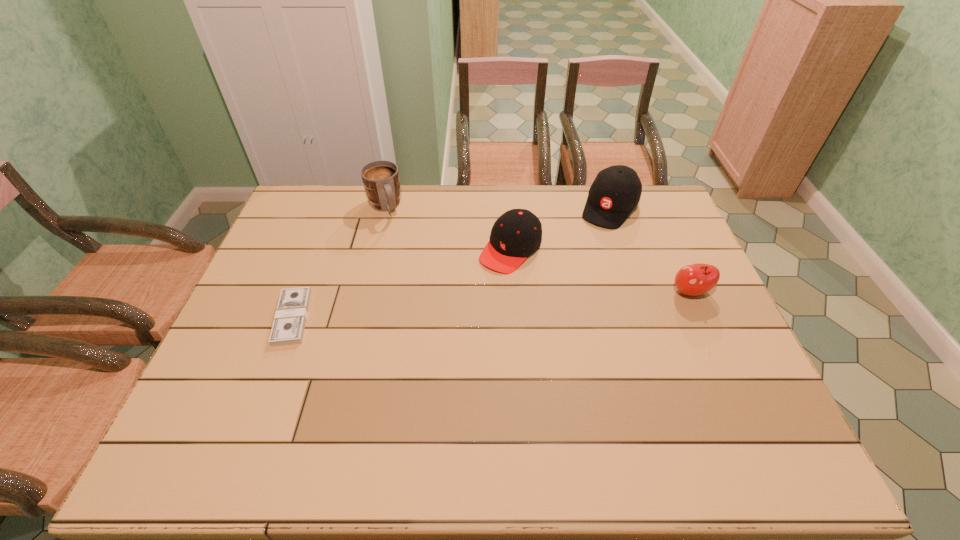
Where is `free space on the desktop that is between the dollar and the apple and is positioned on the front-facing side of the cap`? This screenshot has height=540, width=960. free space on the desktop that is between the dollar and the apple and is positioned on the front-facing side of the cap is located at coordinates (457, 307).

This screenshot has height=540, width=960. Find the location of `free space on the desktop that is between the shortest object and the apple and is positioned on the side of the mug with the handle`. free space on the desktop that is between the shortest object and the apple and is positioned on the side of the mug with the handle is located at coordinates (x=438, y=308).

The width and height of the screenshot is (960, 540). I want to click on vacant space on the desktop that is between the leftmost object and the apple and is positioned with a logo on the front of the baseball cap, so click(x=549, y=301).